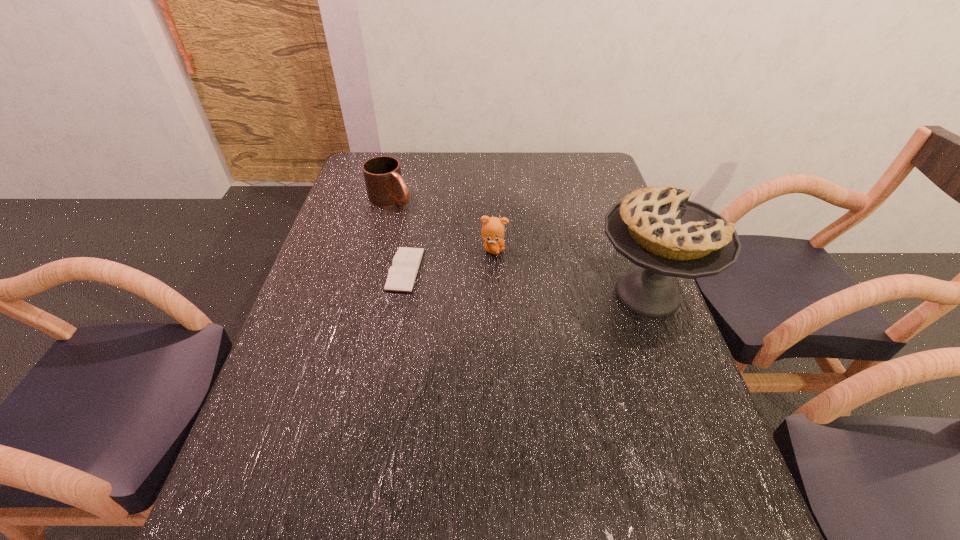
The image size is (960, 540). I want to click on free spot between the pie and the diary, so click(x=526, y=282).

Locate an element on the screen. empty space between the diary and the second object from right to left is located at coordinates (449, 260).

You are a GUI agent. You are given a task and a screenshot of the screen. Output one action in this format:
    pyautogui.click(x=<x>, y=<y>)
    Task: Click on the free space between the mug and the pie
    
    Given the screenshot: What is the action you would take?
    pyautogui.click(x=519, y=246)

This screenshot has height=540, width=960. I want to click on vacant space that's between the diary and the tallest object, so click(526, 282).

Locate an element on the screen. Image resolution: width=960 pixels, height=540 pixels. vacant area that lies between the shortest object and the farthest object is located at coordinates (398, 234).

The height and width of the screenshot is (540, 960). I want to click on free space between the teddy bear and the pie, so click(x=571, y=272).

Image resolution: width=960 pixels, height=540 pixels. I want to click on vacant area that lies between the shortest object and the teddy bear, so click(x=449, y=260).

Identify the location of vacant space that is in between the teddy bear and the pie. (571, 272).

This screenshot has height=540, width=960. I want to click on vacant space that's between the diary and the second object from right to left, so click(x=449, y=260).

Select which object is the second closest to the pie. Please provide its 2D coordinates. Your answer should be formatted as a tuple, i.e. [(x, y)], where the tuple contains the x and y coordinates of a point satisfying the conditions above.

[(402, 274)]